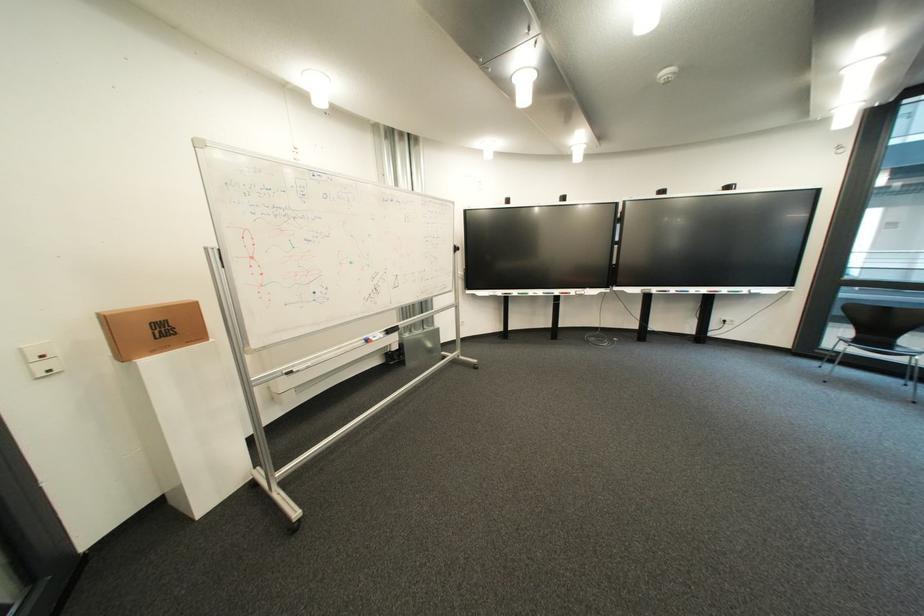
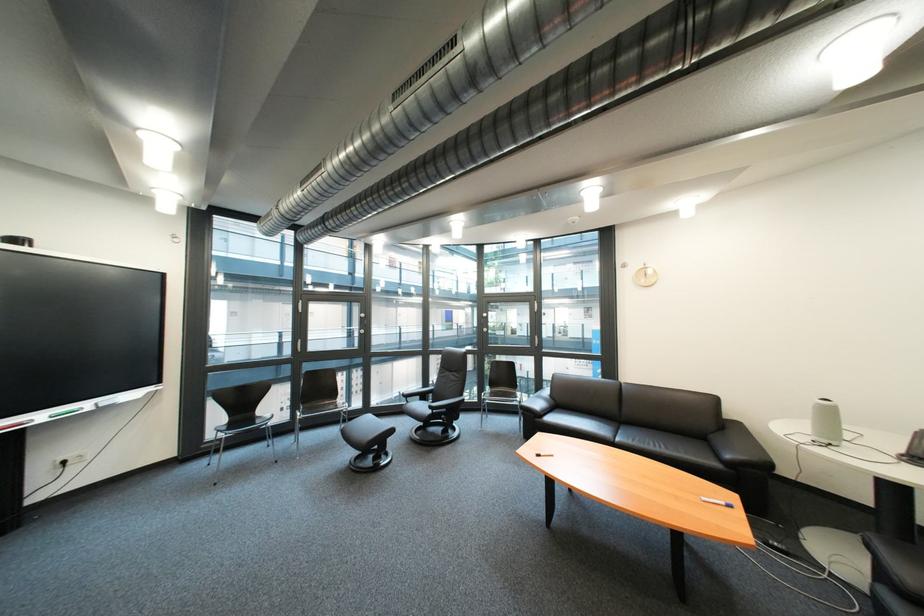
Find the pixel in the second image that matches [870,342] in the first image.

(246, 426)